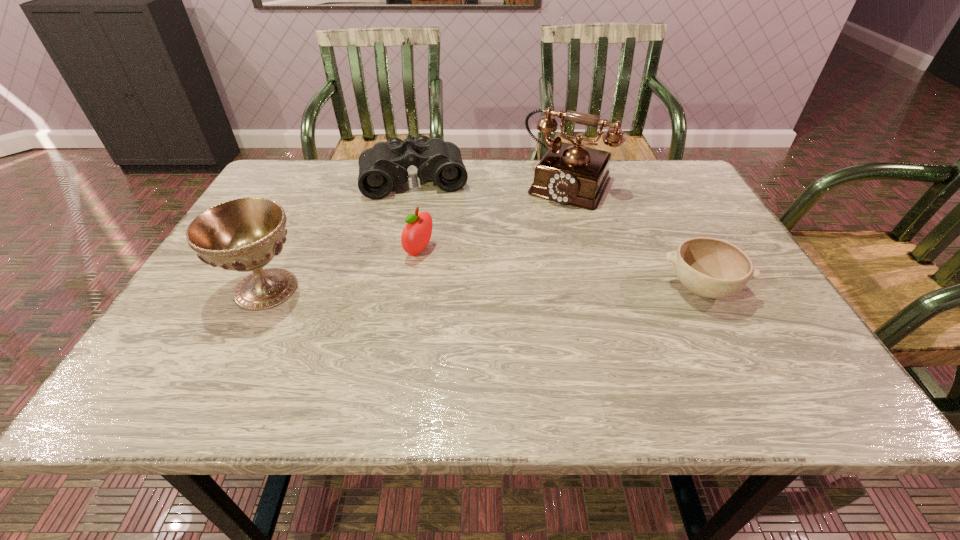
Identify the location of vacant area that lies between the apple and the leftmost object. This screenshot has width=960, height=540. (343, 270).

At what (x,y) coordinates should I click in order to perform the action: click on free space between the apple and the fourth shortest object. Please return your answer as a coordinate pair (x, y). Image resolution: width=960 pixels, height=540 pixels. Looking at the image, I should click on (343, 270).

Locate an element on the screen. Image resolution: width=960 pixels, height=540 pixels. free spot between the leftmost object and the binoculars is located at coordinates (340, 234).

The image size is (960, 540). I want to click on free space between the bowl and the tallest object, so click(x=635, y=235).

Find the location of a particular element. The width and height of the screenshot is (960, 540). vacant point located between the binoculars and the bowl is located at coordinates (558, 234).

In order to click on vacant area between the apple and the fourth shortest object in this screenshot , I will do `click(343, 270)`.

The image size is (960, 540). Find the location of `the second closest object relative to the tallest object`. the second closest object relative to the tallest object is located at coordinates (712, 268).

Point out which object is positioned as the second nearest to the chalice. Please provide its 2D coordinates. Your answer should be formatted as a tuple, i.e. [(x, y)], where the tuple contains the x and y coordinates of a point satisfying the conditions above.

[(385, 165)]

Locate an element on the screen. This screenshot has width=960, height=540. vacant space that satisfies the following two spatial constraints: 1. on the front side of the apple; 2. on the right side of the binoculars is located at coordinates (399, 251).

Where is `free space that satisfies the following two spatial constraints: 1. on the front side of the apple; 2. on the left side of the shortest object`? The image size is (960, 540). free space that satisfies the following two spatial constraints: 1. on the front side of the apple; 2. on the left side of the shortest object is located at coordinates (414, 288).